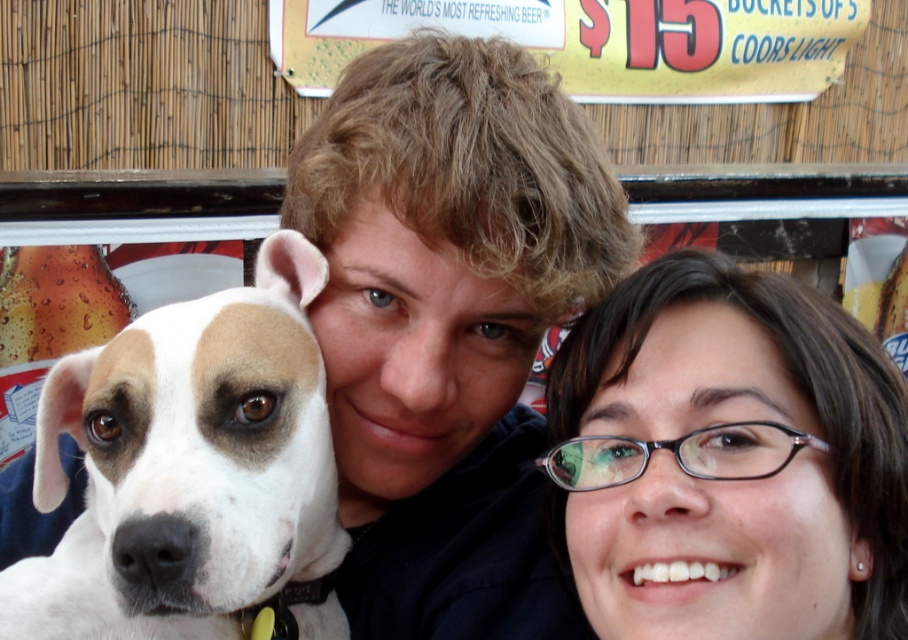
You are taking a photo of the scene and need to ensure that both the matte black glasses at upper right and the white fur at left are clearly visible. Based on their positions, which object is closer to the right edge of the photo?

The matte black glasses at upper right is positioned on the right side of white fur at left, so it is closer to the right edge of the photo.

You are standing in front of the scene described. There are two objects of interest here. The first is the matte black shirt at center, and the second is the white fur at left. From your perspective, which object is positioned to the right of the other?

The matte black shirt at center is to the right of white fur at left, so the matte black shirt at center is positioned to the right of the white fur at left.

You are taking a photo of the matte black shirt at center and the matte black glasses at upper right. Which object is closer to the camera?

The matte black shirt at center is closer to the camera than the matte black glasses at upper right because it is positioned over the glasses.